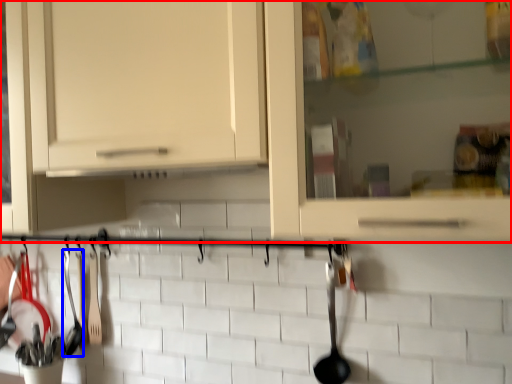
Question: Which object appears farthest to the camera in this image, cabinetry (highlighted by a red box) or silverware (highlighted by a blue box)?

Choices:
 (A) cabinetry
 (B) silverware

Answer: (B)